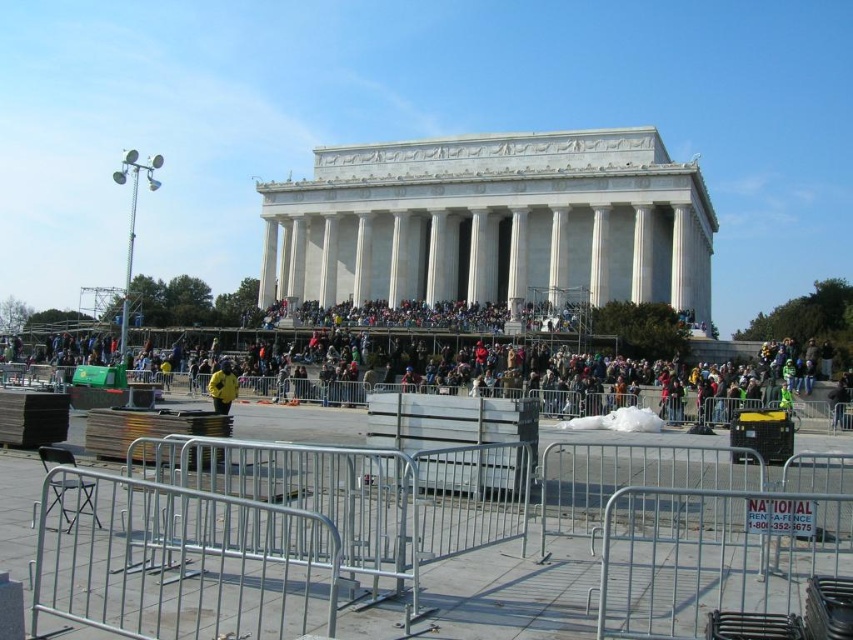
Question: Which object appears closest to the camera in this image?

Choices:
 (A) silver metallic fence at lower center
 (B) dark brown leather jacket at center

Answer: (A)

Question: Which of the following is the farthest from the observer?

Choices:
 (A) (693, 358)
 (B) (184, 570)
 (C) (209, 387)

Answer: (A)

Question: Is silver metallic fence at lower center bigger than dark brown leather jacket at center?

Choices:
 (A) yes
 (B) no

Answer: (B)

Question: Which of these objects is positioned farthest from the yellow jacket at center?

Choices:
 (A) silver metallic fence at lower center
 (B) dark brown leather jacket at center

Answer: (A)

Question: Is silver metallic fence at lower center smaller than yellow jacket at center?

Choices:
 (A) yes
 (B) no

Answer: (B)

Question: Does silver metallic fence at lower center come behind yellow jacket at center?

Choices:
 (A) no
 (B) yes

Answer: (A)